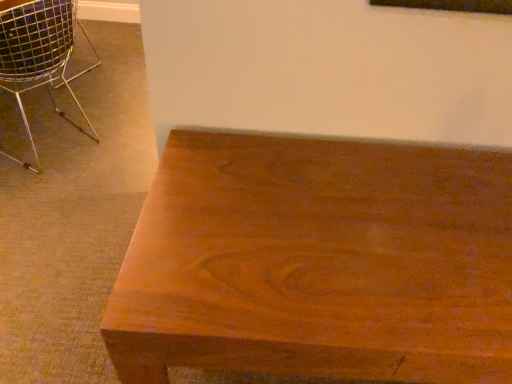
Question: Would you say satin wood table at lower right is inside or outside metallic wire chair at left?

Choices:
 (A) outside
 (B) inside

Answer: (A)

Question: Considering the positions of satin wood table at lower right and metallic wire chair at left in the image, is satin wood table at lower right taller or shorter than metallic wire chair at left?

Choices:
 (A) short
 (B) tall

Answer: (B)

Question: Considering their positions, is satin wood table at lower right located in front of or behind metallic wire chair at left?

Choices:
 (A) front
 (B) behind

Answer: (A)

Question: In terms of height, does metallic wire chair at left look taller or shorter compared to satin wood table at lower right?

Choices:
 (A) short
 (B) tall

Answer: (A)

Question: From the image's perspective, relative to satin wood table at lower right, is metallic wire chair at left above or below?

Choices:
 (A) below
 (B) above

Answer: (B)

Question: In terms of size, does metallic wire chair at left appear bigger or smaller than satin wood table at lower right?

Choices:
 (A) small
 (B) big

Answer: (A)

Question: Considering their positions, is metallic wire chair at left located in front of or behind satin wood table at lower right?

Choices:
 (A) front
 (B) behind

Answer: (B)